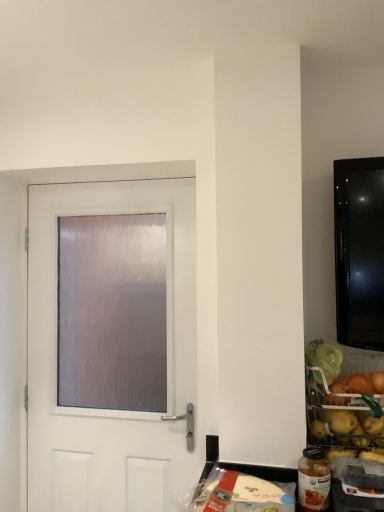
Question: From a real-world perspective, is golden potatoes at right, which is the second food from bottom to top, positioned under translucent plastic bag at lower center, arranged as the second food when viewed from the top, based on gravity?

Choices:
 (A) yes
 (B) no

Answer: (B)

Question: Does golden potatoes at right, arranged as the 2th food when viewed from the left, have a lesser width compared to translucent plastic bag at lower center, the first food positioned from the left?

Choices:
 (A) no
 (B) yes

Answer: (B)

Question: Is the position of golden potatoes at right, the 1th food from the right, less distant than that of translucent plastic bag at lower center, the first food positioned from the left?

Choices:
 (A) no
 (B) yes

Answer: (A)

Question: Can you confirm if golden potatoes at right, arranged as the 2th food when viewed from the left, is taller than translucent plastic bag at lower center, which is counted as the 1th food, starting from the bottom?

Choices:
 (A) yes
 (B) no

Answer: (A)

Question: From a real-world perspective, does golden potatoes at right, arranged as the 2th food when viewed from the left, stand above translucent plastic bag at lower center, which is counted as the 1th food, starting from the bottom?

Choices:
 (A) yes
 (B) no

Answer: (A)

Question: From the image's perspective, does golden potatoes at right, the 1th food from the right, appear lower than translucent plastic bag at lower center, which is the 2th food in right-to-left order?

Choices:
 (A) no
 (B) yes

Answer: (A)

Question: Can you confirm if white matte door at center is shorter than golden potatoes at right, the first food in the top-to-bottom sequence?

Choices:
 (A) no
 (B) yes

Answer: (A)

Question: Are white matte door at center and golden potatoes at right, the 1th food from the right, located far from each other?

Choices:
 (A) yes
 (B) no

Answer: (B)

Question: Can you see white matte door at center touching golden potatoes at right, the 1th food from the right?

Choices:
 (A) no
 (B) yes

Answer: (A)

Question: Can you confirm if white matte door at center is wider than golden potatoes at right, the first food in the top-to-bottom sequence?

Choices:
 (A) no
 (B) yes

Answer: (A)

Question: From a real-world perspective, is white matte door at center on top of golden potatoes at right, which is the second food from bottom to top?

Choices:
 (A) yes
 (B) no

Answer: (A)

Question: Is white matte door at center thinner than golden potatoes at right, which is the second food from bottom to top?

Choices:
 (A) yes
 (B) no

Answer: (A)

Question: Is golden potatoes at right, the first food in the top-to-bottom sequence, not close to white matte door at center?

Choices:
 (A) no
 (B) yes

Answer: (A)